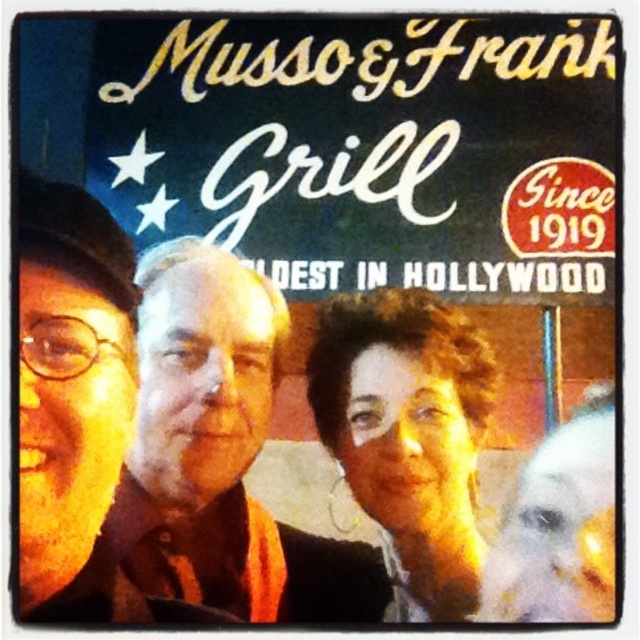
Based on the scene description, where is the smooth brown shirt at center located in the image?

The smooth brown shirt at center is located at point (x=220, y=452).

You are a photographer standing at the back of the Musso and Frank Grill. You want to take a photo of the smooth brown shirt at center and the matte black glasses at left. How far apart are these two items in inches?

The smooth brown shirt at center is 3.39 inches away from matte black glasses at left.

You are standing at the viewer position in the image. There is a point at coordinates point [61,499]. Can you reach that point without moving your body?

The distance between you and point [61,499] is 1.19 meters. Since the average arm length is about 0.7 meters, you cannot reach the point without moving your body.